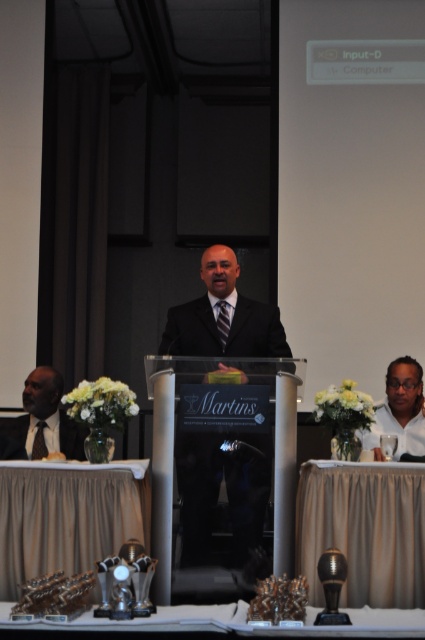
Who is more distant from viewer, (246, 499) or (402, 630)?

Positioned behind is point (246, 499).

Is matte black suit at center closer to the viewer compared to metallic trophies at lower center?

No.

Locate an element on the screen. The image size is (425, 640). matte black suit at center is located at coordinates (218, 492).

Does matte black suit at center come in front of beige fabric table at lower center?

No, matte black suit at center is further to the viewer.

In order to click on matte black suit at center in this screenshot , I will do `click(218, 492)`.

Identify the location of matte black suit at center. (218, 492).

Between matte black suit at center and matte black suit at left, which one appears on the right side from the viewer's perspective?

matte black suit at center is more to the right.

Which is below, matte black suit at center or matte black suit at left?

matte black suit at left

Does point (184, 458) come closer to viewer compared to point (45, 445)?

Yes, it is.

Locate an element on the screen. matte black suit at center is located at coordinates (218, 492).